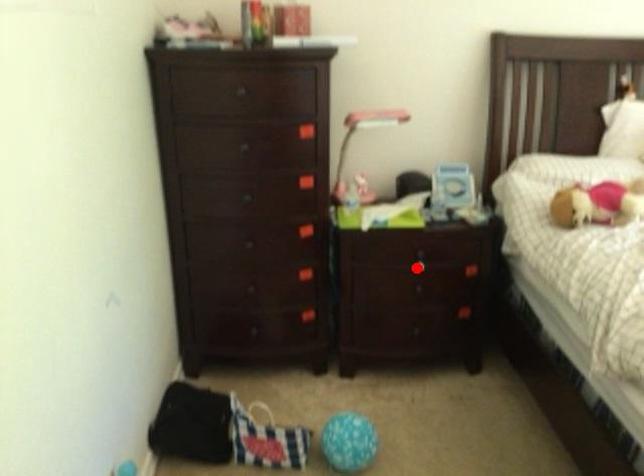
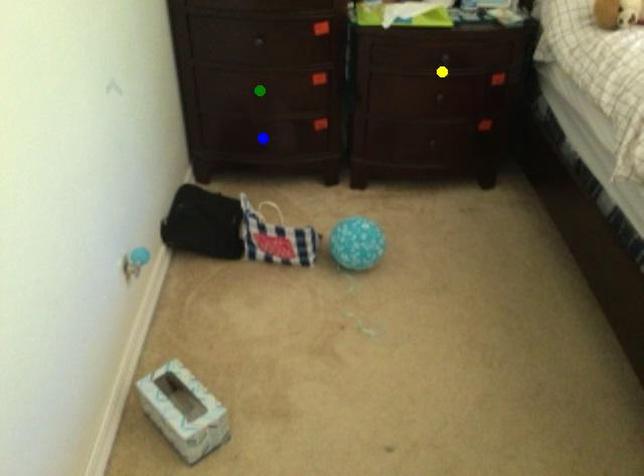
Question: I am providing you with two images of the same scene from different viewpoints. A red point is marked on the first image. You are given multiple points on the second image. Can you choose the point in image 2 that corresponds to the point in image 1?

Choices:
 (A) blue point
 (B) yellow point
 (C) green point

Answer: (B)